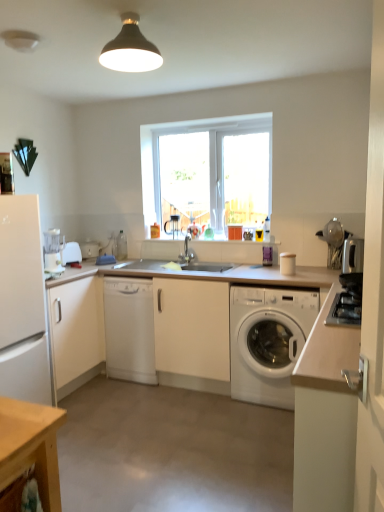
Question: From the image's perspective, would you say satin silver toaster at right, which is counted as the third appliance, starting from the left, is shown under white matte countertop at center?

Choices:
 (A) yes
 (B) no

Answer: (B)

Question: Is satin silver toaster at right, which is counted as the third appliance, starting from the left, further to the viewer compared to white matte countertop at center?

Choices:
 (A) no
 (B) yes

Answer: (B)

Question: From a real-world perspective, is satin silver toaster at right, the third appliance from the back, beneath white matte countertop at center?

Choices:
 (A) yes
 (B) no

Answer: (B)

Question: From the image's perspective, is satin silver toaster at right, the third appliance from the back, on top of white matte countertop at center?

Choices:
 (A) yes
 (B) no

Answer: (A)

Question: Is satin silver toaster at right, which is counted as the third appliance, starting from the left, shorter than white matte countertop at center?

Choices:
 (A) yes
 (B) no

Answer: (A)

Question: From the image's perspective, is satin silver toaster at right, which ranks as the 1th appliance in front-to-back order, positioned above or below white matte cabinet at right, the first cabinetry positioned from the right?

Choices:
 (A) above
 (B) below

Answer: (A)

Question: From a real-world perspective, relative to white matte cabinet at right, which is the 2th cabinetry in back-to-front order, is satin silver toaster at right, which is counted as the third appliance, starting from the left, vertically above or below?

Choices:
 (A) below
 (B) above

Answer: (B)

Question: Choose the correct answer: Is satin silver toaster at right, which ranks as the 1th appliance in front-to-back order, inside white matte cabinet at right, which is the 2th cabinetry in back-to-front order, or outside it?

Choices:
 (A) inside
 (B) outside

Answer: (B)

Question: From their relative heights in the image, would you say satin silver toaster at right, which ranks as the 1th appliance in front-to-back order, is taller or shorter than white matte cabinet at right, marked as the first cabinetry in a front-to-back arrangement?

Choices:
 (A) tall
 (B) short

Answer: (B)

Question: Is white matte refrigerator at left situated inside white matte cabinet at left, the second cabinetry positioned from the front, or outside?

Choices:
 (A) inside
 (B) outside

Answer: (B)

Question: In the image, is white matte refrigerator at left positioned in front of or behind white matte cabinet at left, which is the 2th cabinetry from right to left?

Choices:
 (A) front
 (B) behind

Answer: (A)

Question: From the image's perspective, relative to white matte cabinet at left, which is the first cabinetry from left to right, is white matte refrigerator at left above or below?

Choices:
 (A) above
 (B) below

Answer: (A)

Question: Considering the positions of white matte refrigerator at left and white matte cabinet at left, which is the first cabinetry from left to right, in the image, is white matte refrigerator at left taller or shorter than white matte cabinet at left, which is the first cabinetry from left to right,?

Choices:
 (A) short
 (B) tall

Answer: (B)

Question: Which is correct: white matte dishwasher at center is inside white plastic toaster at left, the 3th appliance from the front, or outside of it?

Choices:
 (A) outside
 (B) inside

Answer: (A)

Question: From a real-world perspective, is white matte dishwasher at center positioned above or below white plastic toaster at left, positioned as the 1th appliance in left-to-right order?

Choices:
 (A) below
 (B) above

Answer: (A)